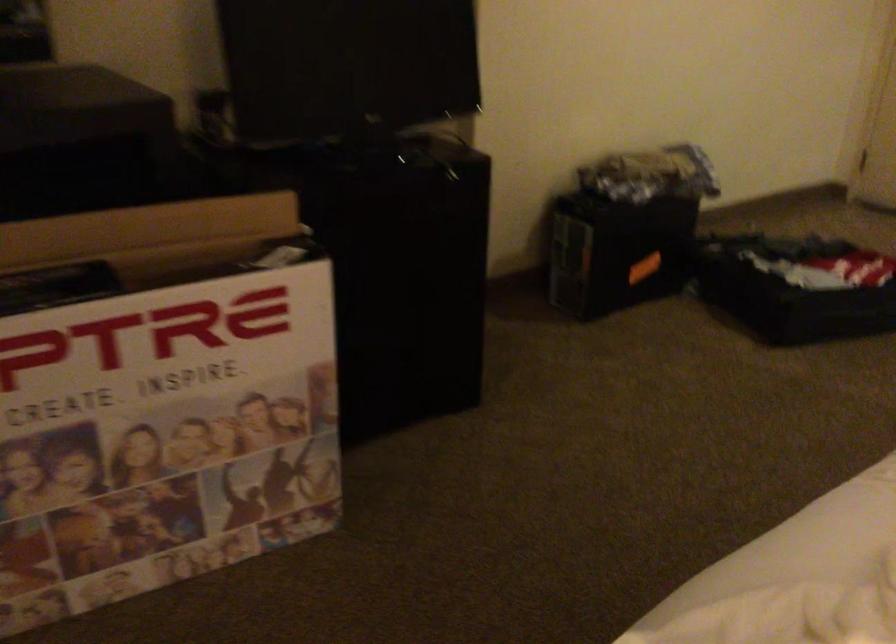
Where would you lift the large cardboard box? Please return your answer as a coordinate pair (x, y).

(171, 393)